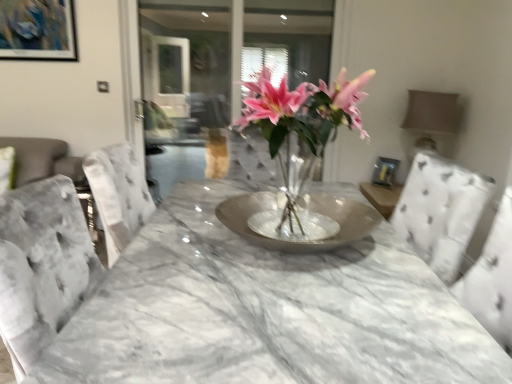
Question: Is transparent glass door at upper center inside the boundaries of pink glass vase at center, or outside?

Choices:
 (A) outside
 (B) inside

Answer: (A)

Question: From the image's perspective, is transparent glass door at upper center located above or below pink glass vase at center?

Choices:
 (A) below
 (B) above

Answer: (B)

Question: Estimate the real-world distances between objects in this image. Which object is farther from the pink glass vase at center?

Choices:
 (A) metallic silver picture frame at upper left
 (B) transparent glass door at upper center

Answer: (B)

Question: Which object is positioned farthest from the transparent glass door at upper center?

Choices:
 (A) pink glass vase at center
 (B) metallic silver picture frame at upper left

Answer: (A)